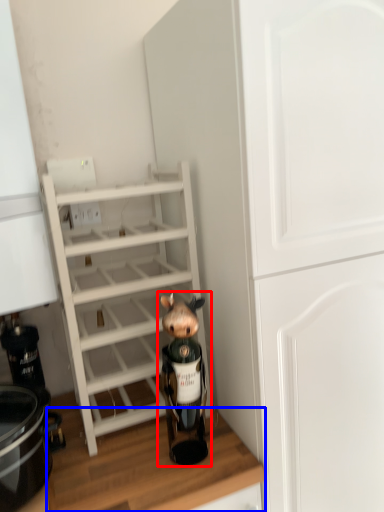
Question: Which object appears closest to the camera in this image, figurine (highlighted by a red box) or counter top (highlighted by a blue box)?

Choices:
 (A) figurine
 (B) counter top

Answer: (B)